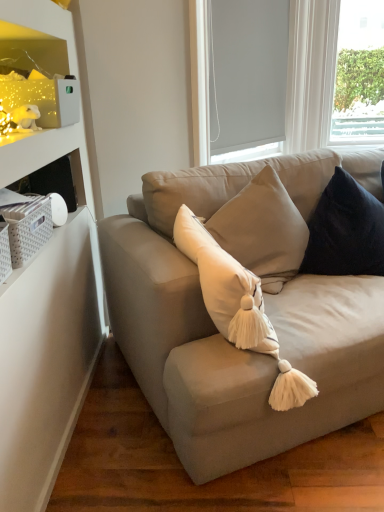
Find the location of a particular element. This screenshot has width=384, height=512. white matte window screen at upper right is located at coordinates (247, 73).

The width and height of the screenshot is (384, 512). In order to click on matte white shelf at upper left in this screenshot , I will do `click(35, 79)`.

The image size is (384, 512). I want to click on window screen located above the matte white shelf at upper left (from a real-world perspective), so click(247, 73).

From the image's perspective, between matte white shelf at upper left and white matte window screen at upper right, who is located below?

matte white shelf at upper left appears lower in the image.

Considering the sizes of objects matte white shelf at upper left and white matte window screen at upper right in the image provided, who is taller, matte white shelf at upper left or white matte window screen at upper right?

white matte window screen at upper right is taller.

Does matte white shelf at upper left appear on the left side of white matte window screen at upper right?

Yes, matte white shelf at upper left is to the left of white matte window screen at upper right.

Would you say suede beige couch at center is to the left or to the right of matte white shelf at upper left in the picture?

Based on their positions, suede beige couch at center is located to the right of matte white shelf at upper left.

Is point (116, 335) farther from viewer compared to point (0, 92)?

Yes, it is.

Between suede beige couch at center and matte white shelf at upper left, which one has less height?

matte white shelf at upper left is shorter.

From a real-world perspective, which object stands above the other?

matte white shelf at upper left.

From the image's perspective, is velvet dark blue pillow at upper right above or below suede beige couch at center?

From the image's perspective, velvet dark blue pillow at upper right appears above suede beige couch at center.

Locate an element on the screen. studio couch below the velvet dark blue pillow at upper right (from the image's perspective) is located at coordinates (238, 353).

Are velvet dark blue pillow at upper right and suede beige couch at center making contact?

No, velvet dark blue pillow at upper right is not beside suede beige couch at center.

From a real-world perspective, is suede beige couch at center physically below white roller blind at upper center?

Yes, from a real-world perspective, suede beige couch at center is under white roller blind at upper center.

Does suede beige couch at center have a greater height compared to white roller blind at upper center?

In fact, suede beige couch at center may be shorter than white roller blind at upper center.

From the image's perspective, who appears lower, suede beige couch at center or white roller blind at upper center?

suede beige couch at center.

From the picture: Between suede beige couch at center and white roller blind at upper center, which one appears on the right side from the viewer's perspective?

suede beige couch at center.

Does white matte window screen at upper right appear on the right side of white roller blind at upper center?

Incorrect, white matte window screen at upper right is not on the right side of white roller blind at upper center.

Would you say white matte window screen at upper right is a long distance from white roller blind at upper center?

No, white matte window screen at upper right is not far from white roller blind at upper center.

Locate an element on the screen. This screenshot has width=384, height=512. window screen on the left of white roller blind at upper center is located at coordinates (247, 73).

Considering the sizes of objects white matte window screen at upper right and white roller blind at upper center in the image provided, who is taller, white matte window screen at upper right or white roller blind at upper center?

white roller blind at upper center.

Is suede beige couch at center placed right next to white matte window screen at upper right?

No, suede beige couch at center is not with white matte window screen at upper right.

Which object is positioned more to the left, suede beige couch at center or white matte window screen at upper right?

Positioned to the left is white matte window screen at upper right.

Is white matte window screen at upper right at the back of suede beige couch at center?

No.

Consider the image. How many degrees apart are the facing directions of white roller blind at upper center and suede beige couch at center?

The facing directions of white roller blind at upper center and suede beige couch at center are 22 degrees apart.

From the picture: From a real-world perspective, is white roller blind at upper center located beneath suede beige couch at center?

Actually, white roller blind at upper center is physically above suede beige couch at center in the real world.

Which of these two, white roller blind at upper center or suede beige couch at center, stands taller?

Standing taller between the two is white roller blind at upper center.

Where is `window screen above the matte white shelf at upper left (from a real-world perspective)`? window screen above the matte white shelf at upper left (from a real-world perspective) is located at coordinates (247, 73).

Identify the location of shelf on the left of the suede beige couch at center. The width and height of the screenshot is (384, 512). (35, 79).

Based on their spatial positions, is velvet dark blue pillow at upper right or matte white shelf at upper left further from white roller blind at upper center?

matte white shelf at upper left.

Based on their spatial positions, is velvet dark blue pillow at upper right or white matte window screen at upper right further from suede beige couch at center?

white matte window screen at upper right lies further to suede beige couch at center than the other object.

Considering their positions, is velvet dark blue pillow at upper right positioned further to white matte window screen at upper right than white roller blind at upper center?

velvet dark blue pillow at upper right is positioned further to the anchor white matte window screen at upper right.

Which object lies nearer to the anchor point white matte window screen at upper right, velvet dark blue pillow at upper right or matte white shelf at upper left?

velvet dark blue pillow at upper right is positioned closer to the anchor white matte window screen at upper right.

Estimate the real-world distances between objects in this image. Which object is closer to velvet dark blue pillow at upper right, white matte window screen at upper right or white roller blind at upper center?

white matte window screen at upper right is positioned closer to the anchor velvet dark blue pillow at upper right.

From the image, which object appears to be farther from velvet dark blue pillow at upper right, matte white shelf at upper left or white roller blind at upper center?

white roller blind at upper center.

Which object lies nearer to the anchor point white matte window screen at upper right, matte white shelf at upper left or suede beige couch at center?

The object closer to white matte window screen at upper right is matte white shelf at upper left.

In the scene shown: Which object lies further to the anchor point matte white shelf at upper left, white matte window screen at upper right or white roller blind at upper center?

white roller blind at upper center lies further to matte white shelf at upper left than the other object.

I want to click on bay window between white matte window screen at upper right and suede beige couch at center in the up-down direction, so click(310, 73).

This screenshot has height=512, width=384. I want to click on pillow between white roller blind at upper center and suede beige couch at center vertically, so click(x=345, y=231).

At what (x,y) coordinates should I click in order to perform the action: click on pillow between white matte window screen at upper right and suede beige couch at center from top to bottom. Please return your answer as a coordinate pair (x, y). Looking at the image, I should click on (345, 231).

Where is `bay window between matte white shelf at upper left and velvet dark blue pillow at upper right in the horizontal direction`? This screenshot has height=512, width=384. bay window between matte white shelf at upper left and velvet dark blue pillow at upper right in the horizontal direction is located at coordinates (310, 73).